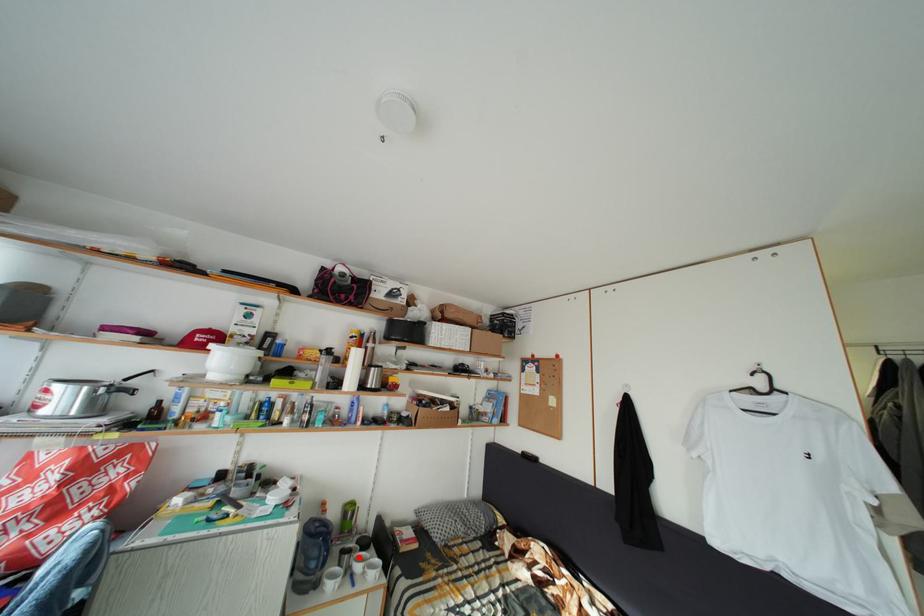
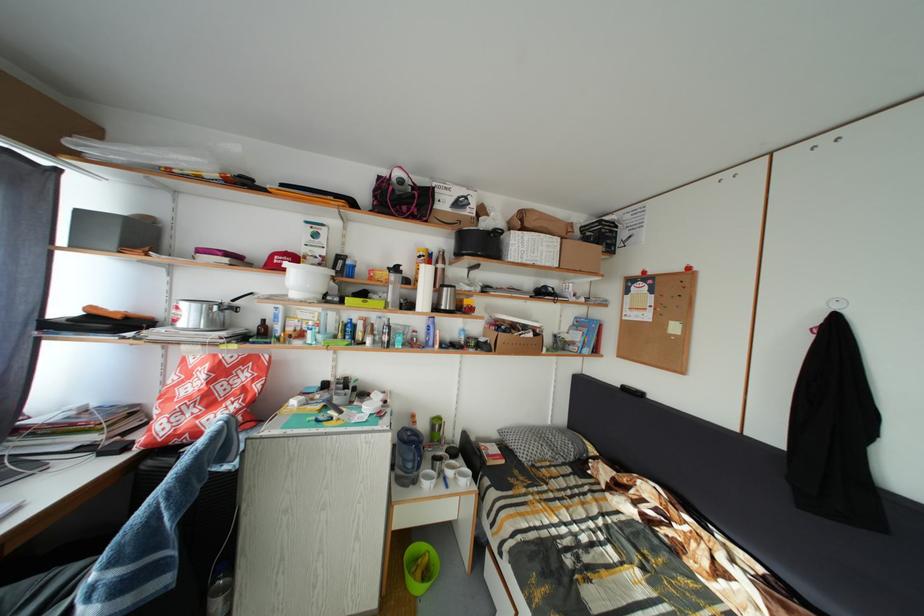
Question: I am providing you with two images of the same scene from different viewpoints. Image1 has a red point marked. In image2, the corresponding 3D location appears at what relative position? Reply with the corresponding letter.

Choices:
 (A) Closer
 (B) Farther

Answer: (B)